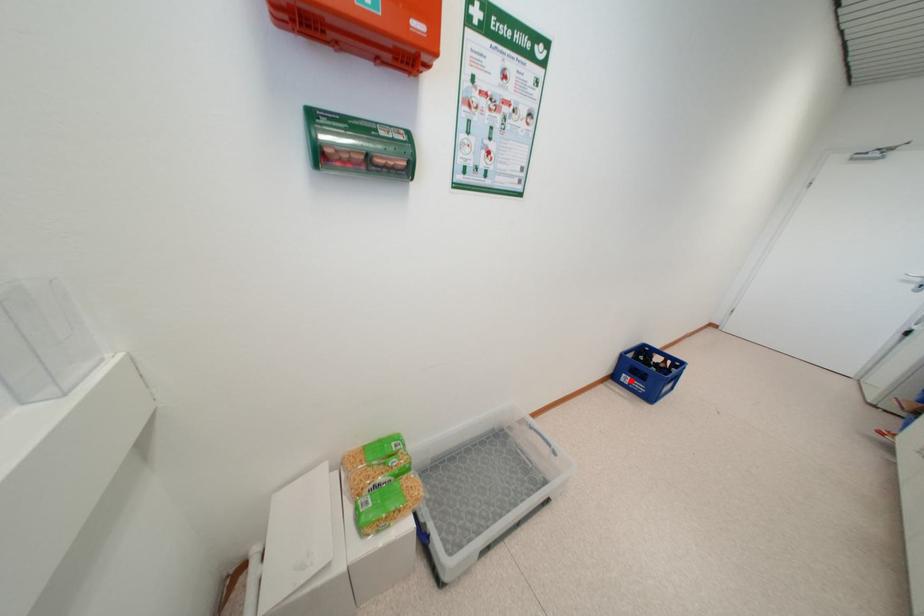
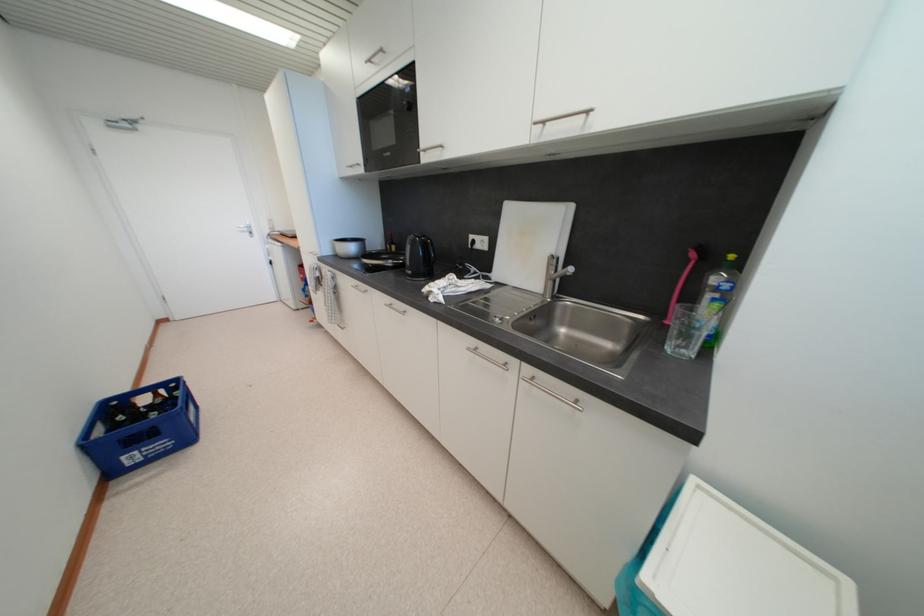
In the second image, find the point that corresponds to the highlighted location in the first image.

(138, 460)